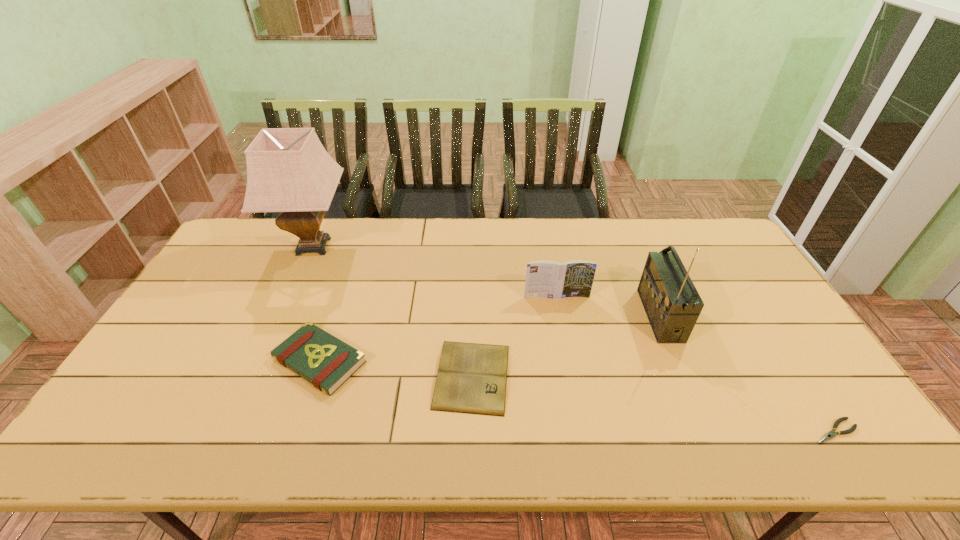
Locate an element on the screen. The image size is (960, 540). free space between the leftmost book and the fifth object from left to right is located at coordinates (490, 338).

Locate an element on the screen. This screenshot has height=540, width=960. vacant space that's between the second tallest book and the second book from right to left is located at coordinates (396, 368).

Identify the location of blank region between the tallest book and the farthest object. The height and width of the screenshot is (540, 960). (435, 272).

Identify the location of vacant region between the tallest object and the third object from left to right. The height and width of the screenshot is (540, 960). (393, 312).

The width and height of the screenshot is (960, 540). In order to click on free space between the second tallest book and the second shortest object in this screenshot , I will do `click(396, 368)`.

Locate an element on the screen. free space between the tallest object and the leftmost book is located at coordinates (317, 303).

Locate an element on the screen. This screenshot has height=540, width=960. vacant point located between the shortest object and the second shortest book is located at coordinates tap(577, 396).

The height and width of the screenshot is (540, 960). I want to click on vacant area between the shortest book and the third object from right to left, so click(x=515, y=336).

Locate an element on the screen. The image size is (960, 540). empty space that is in between the second shortest object and the radio receiver is located at coordinates pyautogui.click(x=565, y=346).

Locate which object is the fourth closest to the farthest object. Please provide its 2D coordinates. Your answer should be formatted as a tuple, i.e. [(x, y)], where the tuple contains the x and y coordinates of a point satisfying the conditions above.

[(671, 301)]